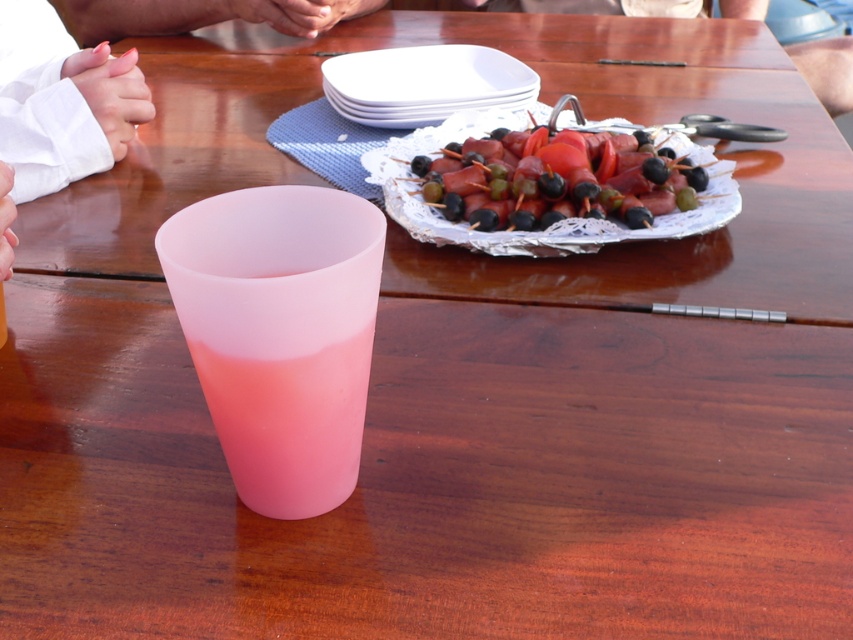
Between semi-glossy plastic skewers at upper right and white matte platter at upper center, which one is positioned higher?

white matte platter at upper center is above.

Is semi-glossy plastic skewers at upper right taller than white matte platter at upper center?

In fact, semi-glossy plastic skewers at upper right may be shorter than white matte platter at upper center.

Locate an element on the screen. This screenshot has height=640, width=853. semi-glossy plastic skewers at upper right is located at coordinates (555, 179).

Does translucent pink cup at center lie in front of semi-glossy plastic skewers at upper right?

Yes, translucent pink cup at center is in front of semi-glossy plastic skewers at upper right.

Between point (263, 458) and point (509, 188), which one is positioned behind?

Positioned behind is point (509, 188).

Where is `translucent pink cup at center`? translucent pink cup at center is located at coordinates pyautogui.click(x=289, y=422).

Does point (479, 214) come in front of point (13, 150)?

Yes.

Can you confirm if semi-glossy plastic skewers at upper right is taller than white satin cuffs at left?

In fact, semi-glossy plastic skewers at upper right may be shorter than white satin cuffs at left.

Between point (445, 218) and point (94, 120), which one is positioned behind?

The point (94, 120) is behind.

I want to click on semi-glossy plastic skewers at upper right, so [555, 179].